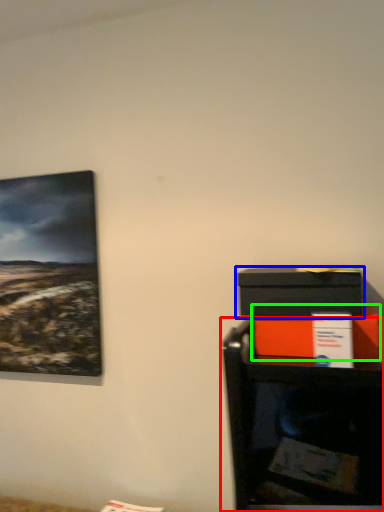
Question: Which object is the closest to the furniture (highlighted by a red box)? Choose among these: box (highlighted by a blue box) or box (highlighted by a green box).

Choices:
 (A) box
 (B) box

Answer: (B)